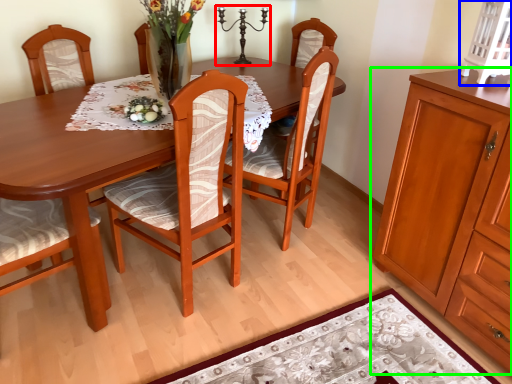
Question: Which is nearer to the candle holder (highlighted by a red box)? cabinetry (highlighted by a blue box) or cabinetry (highlighted by a green box).

Choices:
 (A) cabinetry
 (B) cabinetry

Answer: (A)